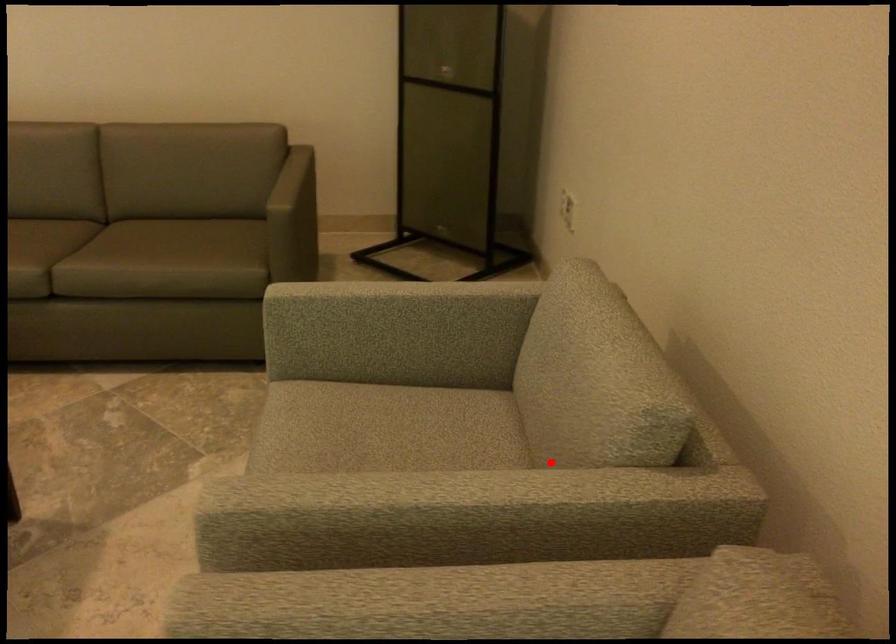
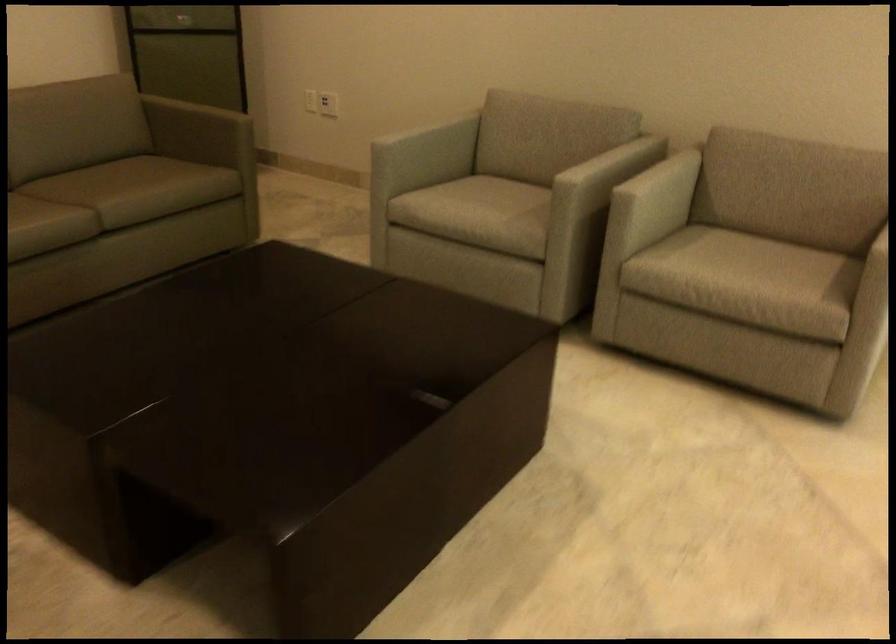
In the second image, find the point that corresponds to the highlighted location in the first image.

(588, 149)